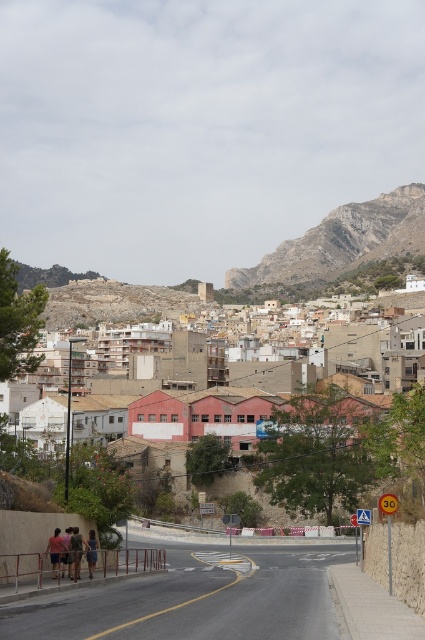
You are a delivery robot with a 1.5 meter wide package. You need to navigate through the space between the denim shorts at lower left and the light brown leather jacket at lower left. Can you fit through that space with your package?

The distance between the denim shorts at lower left and the light brown leather jacket at lower left is 2.44 meters. Since your package is 1.5 meters wide, there is enough space to fit through as 2.44 meters is greater than 1.5 meters.

Consider the image. You are standing at the pedestrian crossing on the road and want to take a photo of the rugged stone mountain at upper right without including the light brown leather jacket at lower left in the frame. Which direction should you move to achieve this?

Move to the right side of the light brown leather jacket at lower left since the rugged stone mountain at upper right is positioned on the right side of it, allowing you to frame the mountain without the jacket in the shot.

You are a photographer standing at the pedestrian crossing on the road. You notice a person wearing a matte gray shirt at lower left and denim shorts at lower left in the scene. Which clothing item appears bigger in the photo?

The matte gray shirt at lower left appears bigger in the photo because it has a larger size compared to the denim shorts at lower left.